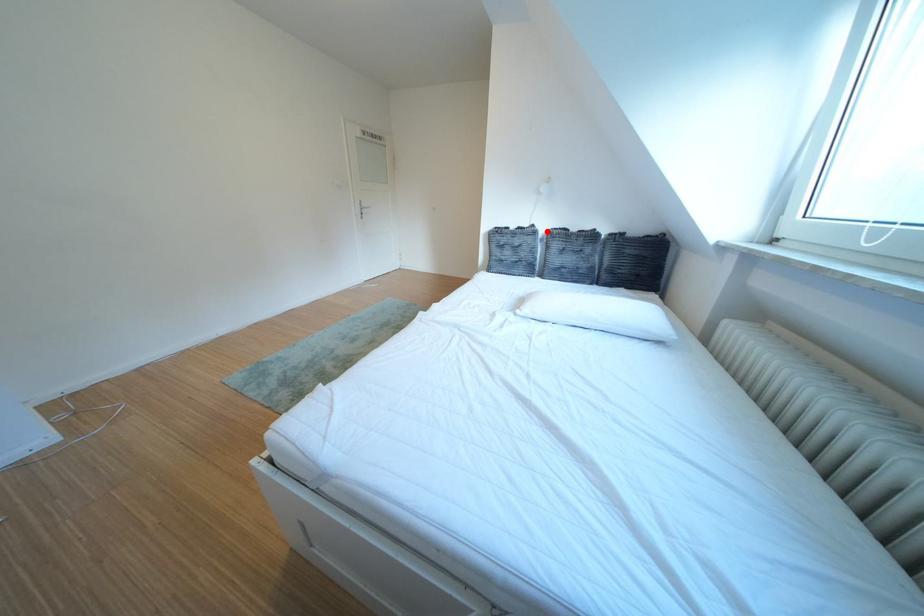
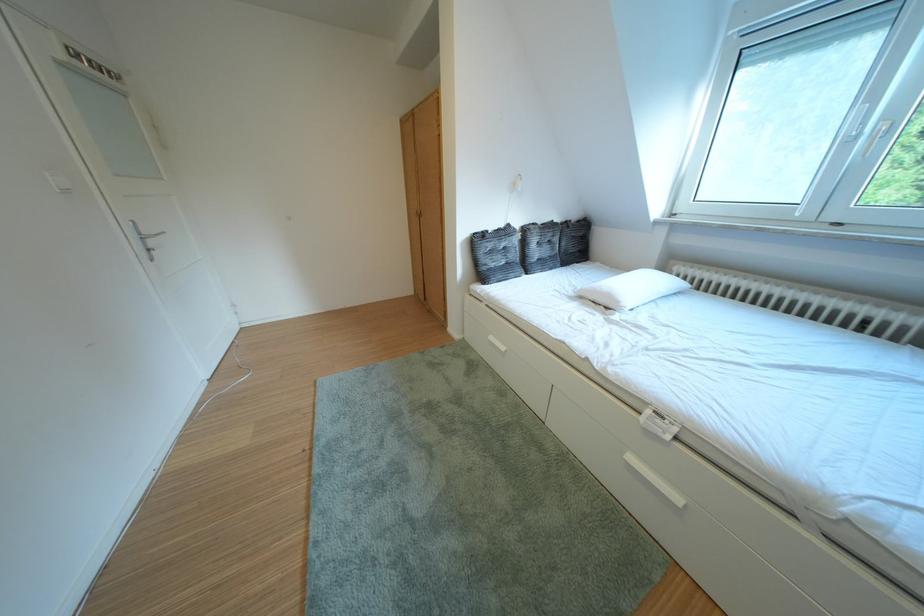
Locate, in the second image, the point that corresponds to the highlighted location in the first image.

(523, 230)